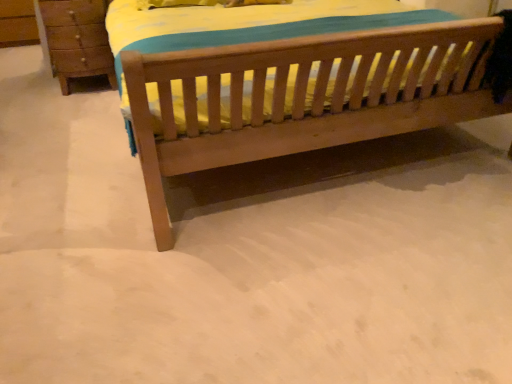
Question: Is wooden bed at center positioned before wooden chest of drawers at left?

Choices:
 (A) no
 (B) yes

Answer: (B)

Question: From the image's perspective, is wooden bed at center located beneath wooden chest of drawers at left?

Choices:
 (A) no
 (B) yes

Answer: (B)

Question: Are wooden bed at center and wooden chest of drawers at left making contact?

Choices:
 (A) yes
 (B) no

Answer: (B)

Question: Can you confirm if wooden bed at center is bigger than wooden chest of drawers at left?

Choices:
 (A) no
 (B) yes

Answer: (B)

Question: Can you confirm if wooden bed at center is taller than wooden chest of drawers at left?

Choices:
 (A) yes
 (B) no

Answer: (B)

Question: Is wooden bed at center smaller than wooden chest of drawers at left?

Choices:
 (A) yes
 (B) no

Answer: (B)

Question: From a real-world perspective, is wooden chest of drawers at left located higher than wooden bed at center?

Choices:
 (A) yes
 (B) no

Answer: (A)

Question: Is wooden bed at center inside wooden chest of drawers at left?

Choices:
 (A) no
 (B) yes

Answer: (A)

Question: Does wooden chest of drawers at left have a lesser height compared to wooden bed at center?

Choices:
 (A) yes
 (B) no

Answer: (B)

Question: Does wooden chest of drawers at left have a greater height compared to wooden bed at center?

Choices:
 (A) yes
 (B) no

Answer: (A)

Question: Is wooden chest of drawers at left touching wooden bed at center?

Choices:
 (A) yes
 (B) no

Answer: (B)

Question: From the image's perspective, is wooden chest of drawers at left located above wooden bed at center?

Choices:
 (A) no
 (B) yes

Answer: (B)

Question: Considering their positions, is wooden chest of drawers at left located in front of or behind wooden bed at center?

Choices:
 (A) behind
 (B) front

Answer: (A)